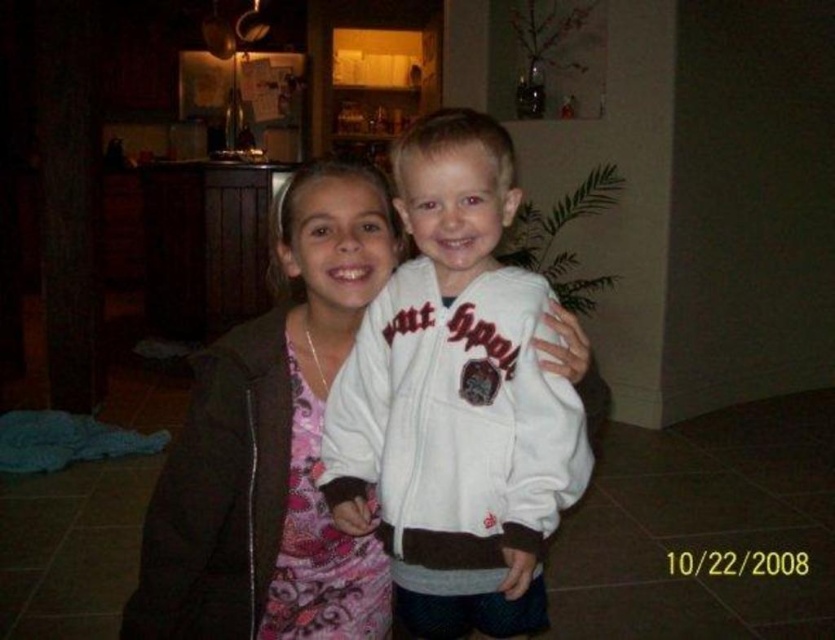
What do you see at coordinates (456, 400) in the screenshot? I see `white fleece jacket at center` at bounding box center [456, 400].

I want to click on white fleece jacket at center, so pos(456,400).